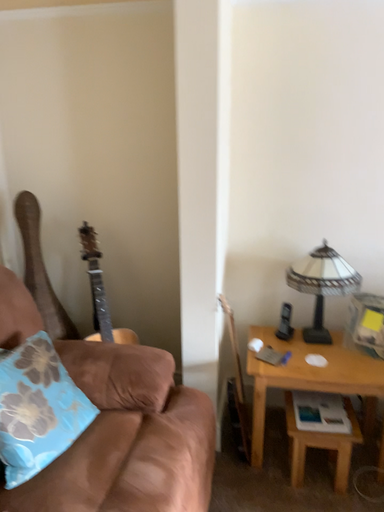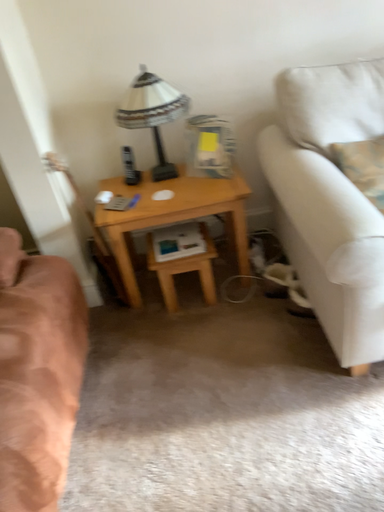
Question: How did the camera likely rotate when shooting the video?

Choices:
 (A) rotated right
 (B) rotated left

Answer: (A)